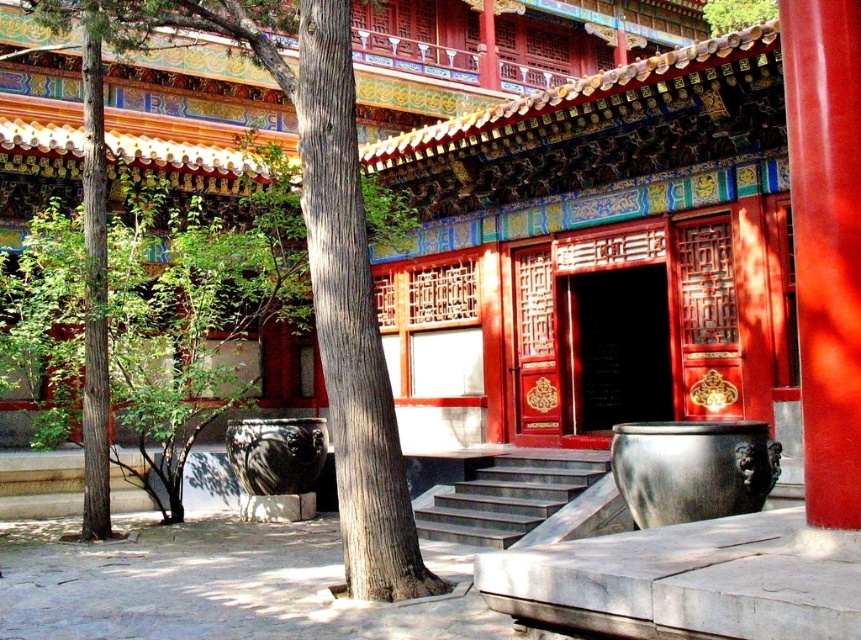
Does brown textured tree at center appear under dark gray stone stairs at center?

No, brown textured tree at center is not below dark gray stone stairs at center.

Is point (102, 4) positioned behind point (584, 483)?

No, (102, 4) is in front of (584, 483).

Locate an element on the screen. Image resolution: width=861 pixels, height=640 pixels. brown textured tree at center is located at coordinates (314, 253).

Can you confirm if smooth glossy red pillar at center is wider than dark gray stone stairs at center?

In fact, smooth glossy red pillar at center might be narrower than dark gray stone stairs at center.

Which is behind, point (835, 304) or point (499, 504)?

Point (499, 504)

Where is `smooth glossy red pillar at center`? The image size is (861, 640). smooth glossy red pillar at center is located at coordinates (827, 244).

Is brown textured tree at center bigger than smooth glossy red pillar at center?

Indeed, brown textured tree at center has a larger size compared to smooth glossy red pillar at center.

Who is more forward, [333,225] or [825,24]?

Point [825,24]

Between point (85, 19) and point (837, 492), which one is positioned behind?

Positioned behind is point (85, 19).

In order to click on brown textured tree at center in this screenshot , I will do `click(314, 253)`.